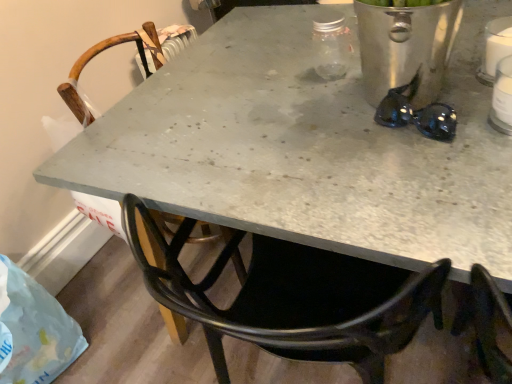
Find the location of `blank space to the left of white plastic bottle at upper right`. blank space to the left of white plastic bottle at upper right is located at coordinates (434, 140).